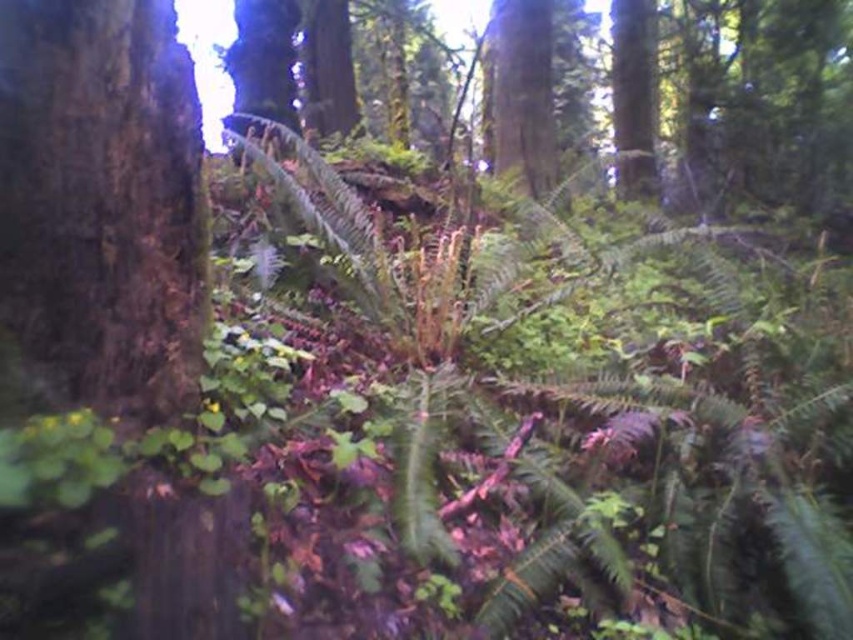
Question: Which of these objects is positioned closest to the smooth bark tree trunk at upper center?

Choices:
 (A) dark brown rough bark at left
 (B) green rough bark tree at upper right

Answer: (B)

Question: Is dark brown rough bark at left below green rough bark tree at upper right?

Choices:
 (A) yes
 (B) no

Answer: (A)

Question: Which is farther from the dark brown rough bark at left?

Choices:
 (A) green rough bark tree at upper right
 (B) smooth bark tree trunk at upper center

Answer: (A)

Question: Is smooth bark tree trunk at upper center smaller than green rough bark tree at upper right?

Choices:
 (A) no
 (B) yes

Answer: (B)

Question: Which object is the farthest from the smooth bark tree trunk at upper center?

Choices:
 (A) green rough bark tree at upper right
 (B) dark brown rough bark at left

Answer: (B)

Question: Does dark brown rough bark at left have a smaller size compared to smooth bark tree trunk at upper center?

Choices:
 (A) no
 (B) yes

Answer: (B)